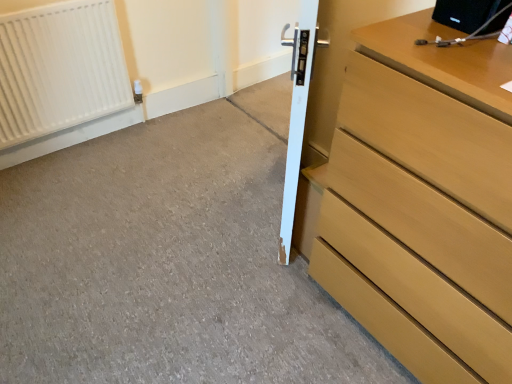
The height and width of the screenshot is (384, 512). Find the location of `white matte radiator at upper left`. white matte radiator at upper left is located at coordinates (60, 69).

Describe the element at coordinates (297, 116) in the screenshot. I see `white glossy door at center` at that location.

You are a GUI agent. You are given a task and a screenshot of the screen. Output one action in this format:
    pyautogui.click(x=<x>, y=<y>)
    Task: Click on the smooth concrete at center
    The width and height of the screenshot is (512, 384).
    Given the screenshot: What is the action you would take?
    pyautogui.click(x=169, y=260)

The width and height of the screenshot is (512, 384). Find the location of `light brown wood chest of drawers at right`. light brown wood chest of drawers at right is located at coordinates (421, 201).

Consider the image. Is smooth concrete at center positioned far away from white matte radiator at upper left?

No, there isn't a large distance between smooth concrete at center and white matte radiator at upper left.

Would you say smooth concrete at center is inside or outside white matte radiator at upper left?

smooth concrete at center lies outside white matte radiator at upper left.

Can you confirm if smooth concrete at center is positioned to the left of white matte radiator at upper left?

No, smooth concrete at center is not to the left of white matte radiator at upper left.

From a real-world perspective, between light brown wood chest of drawers at right and white glossy door at center, who is vertically lower?

light brown wood chest of drawers at right is physically lower.

I want to click on door above the light brown wood chest of drawers at right (from a real-world perspective), so pyautogui.click(x=297, y=116).

Does point (360, 275) lie behind point (298, 84)?

Yes, point (360, 275) is behind point (298, 84).

Can you confirm if light brown wood chest of drawers at right is thinner than white glossy door at center?

Incorrect, the width of light brown wood chest of drawers at right is not less than that of white glossy door at center.

Is white glossy door at center a part of white matte radiator at upper left?

No, white matte radiator at upper left does not contain white glossy door at center.

From a real-world perspective, is white matte radiator at upper left positioned under white glossy door at center based on gravity?

Yes, from a real-world perspective, white matte radiator at upper left is below white glossy door at center.

Is the position of white matte radiator at upper left more distant than that of white glossy door at center?

Yes, it is behind white glossy door at center.

Is white matte radiator at upper left oriented towards white glossy door at center?

Yes, white matte radiator at upper left faces towards white glossy door at center.

Which object is closer to the camera, light brown wood chest of drawers at right or white matte radiator at upper left?

light brown wood chest of drawers at right is more forward.

Which of these two, light brown wood chest of drawers at right or white matte radiator at upper left, stands taller?

Standing taller between the two is light brown wood chest of drawers at right.

I want to click on chest of drawers lying on the right of white matte radiator at upper left, so click(421, 201).

How distant is light brown wood chest of drawers at right from white matte radiator at upper left?

light brown wood chest of drawers at right is 1.59 meters from white matte radiator at upper left.

Is light brown wood chest of drawers at right positioned in front of smooth concrete at center?

Yes, light brown wood chest of drawers at right is closer to the camera.

Considering the relative sizes of light brown wood chest of drawers at right and smooth concrete at center in the image provided, is light brown wood chest of drawers at right wider than smooth concrete at center?

Incorrect, the width of light brown wood chest of drawers at right does not surpass that of smooth concrete at center.

Considering the sizes of light brown wood chest of drawers at right and smooth concrete at center in the image, is light brown wood chest of drawers at right bigger or smaller than smooth concrete at center?

In the image, light brown wood chest of drawers at right appears to be larger than smooth concrete at center.

Is light brown wood chest of drawers at right next to smooth concrete at center?

No, light brown wood chest of drawers at right is not making contact with smooth concrete at center.

Considering the relative sizes of smooth concrete at center and white glossy door at center in the image provided, is smooth concrete at center shorter than white glossy door at center?

Yes, smooth concrete at center is shorter than white glossy door at center.

In the image, there is a smooth concrete at center. Identify the location of door above it (from the image's perspective). (297, 116).

Is smooth concrete at center oriented away from white glossy door at center?

No, smooth concrete at center is not facing the opposite direction of white glossy door at center.

Is white matte radiator at upper left inside white glossy door at center?

No, white glossy door at center does not contain white matte radiator at upper left.

Considering the relative positions of white glossy door at center and white matte radiator at upper left in the image provided, is white glossy door at center to the right of white matte radiator at upper left from the viewer's perspective?

Yes, white glossy door at center is to the right of white matte radiator at upper left.

Which object is wider, white glossy door at center or white matte radiator at upper left?

With larger width is white glossy door at center.

Is white glossy door at center facing away from white matte radiator at upper left?

No, white glossy door at center's orientation is not away from white matte radiator at upper left.

Identify the location of concrete lying in front of the white matte radiator at upper left. (169, 260).

At what (x,y) coordinates should I click in order to perform the action: click on door behind the light brown wood chest of drawers at right. Please return your answer as a coordinate pair (x, y). Image resolution: width=512 pixels, height=384 pixels. Looking at the image, I should click on click(x=297, y=116).

Based on their spatial positions, is white glossy door at center or white matte radiator at upper left further from light brown wood chest of drawers at right?

Based on the image, white matte radiator at upper left appears to be further to light brown wood chest of drawers at right.

When comparing their distances from light brown wood chest of drawers at right, does white matte radiator at upper left or white glossy door at center seem closer?

Based on the image, white glossy door at center appears to be nearer to light brown wood chest of drawers at right.

Estimate the real-world distances between objects in this image. Which object is further from smooth concrete at center, white glossy door at center or light brown wood chest of drawers at right?

light brown wood chest of drawers at right is positioned further to the anchor smooth concrete at center.

Based on their spatial positions, is light brown wood chest of drawers at right or smooth concrete at center further from white matte radiator at upper left?

light brown wood chest of drawers at right lies further to white matte radiator at upper left than the other object.

From the image, which object appears to be farther from white matte radiator at upper left, white glossy door at center or smooth concrete at center?

Among the two, white glossy door at center is located further to white matte radiator at upper left.

Considering their positions, is white matte radiator at upper left positioned further to light brown wood chest of drawers at right than smooth concrete at center?

white matte radiator at upper left lies further to light brown wood chest of drawers at right than the other object.

Which object lies further to the anchor point white glossy door at center, smooth concrete at center or light brown wood chest of drawers at right?

smooth concrete at center is further to white glossy door at center.

When comparing their distances from smooth concrete at center, does white matte radiator at upper left or light brown wood chest of drawers at right seem closer?

Based on the image, white matte radiator at upper left appears to be nearer to smooth concrete at center.

The image size is (512, 384). In order to click on concrete between white matte radiator at upper left and white glossy door at center in the horizontal direction in this screenshot , I will do point(169,260).

Where is `concrete between white matte radiator at upper left and light brown wood chest of drawers at right from left to right`? The height and width of the screenshot is (384, 512). concrete between white matte radiator at upper left and light brown wood chest of drawers at right from left to right is located at coordinates (169, 260).

Where is `door between white matte radiator at upper left and light brown wood chest of drawers at right in the horizontal direction`? This screenshot has width=512, height=384. door between white matte radiator at upper left and light brown wood chest of drawers at right in the horizontal direction is located at coordinates (297, 116).

Where is `door situated between smooth concrete at center and light brown wood chest of drawers at right from left to right`? The height and width of the screenshot is (384, 512). door situated between smooth concrete at center and light brown wood chest of drawers at right from left to right is located at coordinates (297, 116).